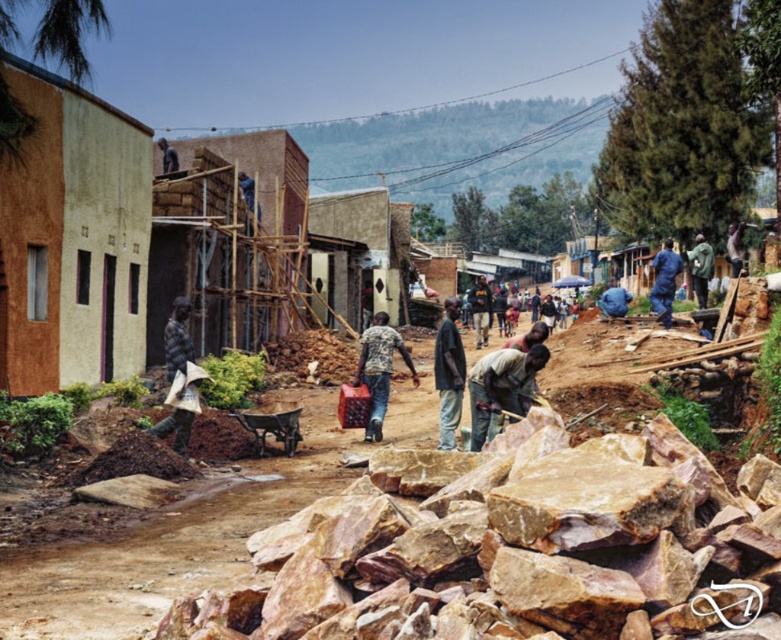
Question: Is dark brown leather hammer at center behind camouflage fabric shirt at center?

Choices:
 (A) no
 (B) yes

Answer: (A)

Question: Which object appears farthest from the camera in this image?

Choices:
 (A) brown rough rocks at center
 (B) dark brown leather jacket at center

Answer: (B)

Question: Does camouflage fabric shirt at center come behind dark gray fabric at center?

Choices:
 (A) yes
 (B) no

Answer: (A)

Question: Which object is closer to the camera taking this photo?

Choices:
 (A) blue fabric at right
 (B) camouflage fabric shirt at center
 (C) blue fabric bag at center
 (D) brown rough rocks at center

Answer: (D)

Question: Observing the image, what is the correct spatial positioning of dark brown leather jacket at center in reference to dark brown wooden pole at upper center?

Choices:
 (A) below
 (B) above

Answer: (A)

Question: Which point appears farthest from the camera in this image?

Choices:
 (A) (662, 316)
 (B) (380, 392)

Answer: (A)